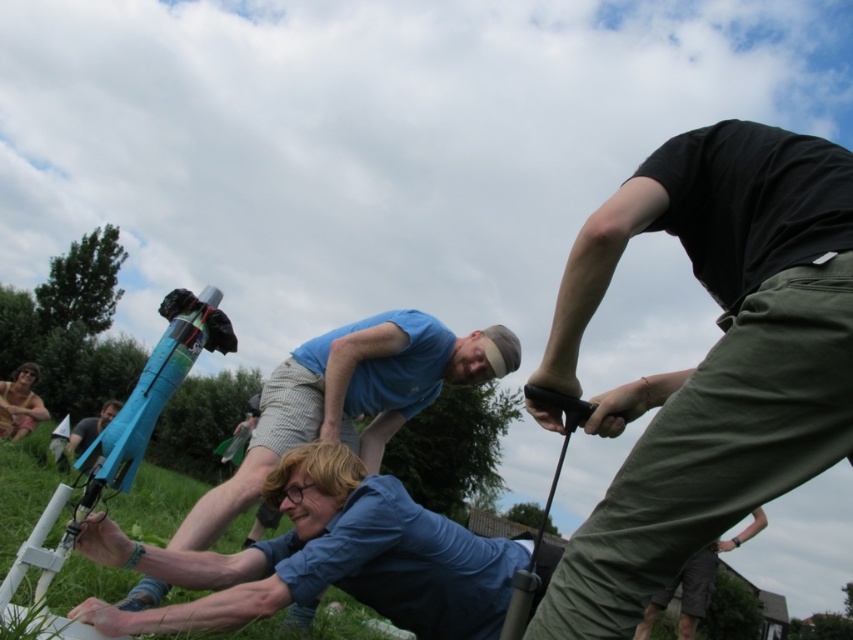
You are a photographer trying to capture the matte blue rocket at left and the black cotton shirt at upper right in the same frame. Which object should you focus on first if you want to ensure both are in focus?

→ The black cotton shirt at upper right is shorter than the matte blue rocket at left, so focusing on the matte blue rocket at left first would help ensure both are in focus.

You are a photographer trying to capture the scene of the rocket launch. You notice the black cotton shirt at upper right and the matte blue rocket at left. Which object should you focus on first if you want to include both in your shot without moving the camera?

The black cotton shirt at upper right is above the matte blue rocket at left, so you should focus on the black cotton shirt at upper right first to ensure both are in frame without moving the camera.

You are trying to determine which object is wider between the blue cotton shirt at center and the green grass at lower left. Based on the scene description, which one is wider?

The blue cotton shirt at center is wider than the green grass at lower left according to the description.